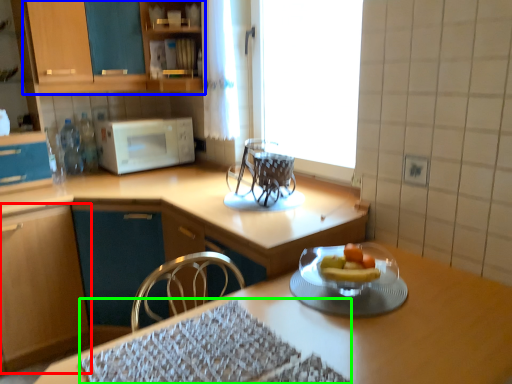
Question: Considering the real-world distances, which object is farthest from cabinetry (highlighted by a red box)? cabinetry (highlighted by a blue box) or place mat (highlighted by a green box)?

Choices:
 (A) cabinetry
 (B) place mat

Answer: (B)